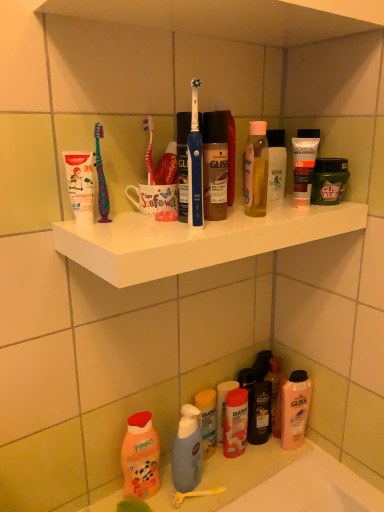
The image size is (384, 512). What are the coordinates of `vacant area situated to the left side of green matte hair mask at upper right, which is the 5th toiletry from bottom to top` in the screenshot? It's located at 269,209.